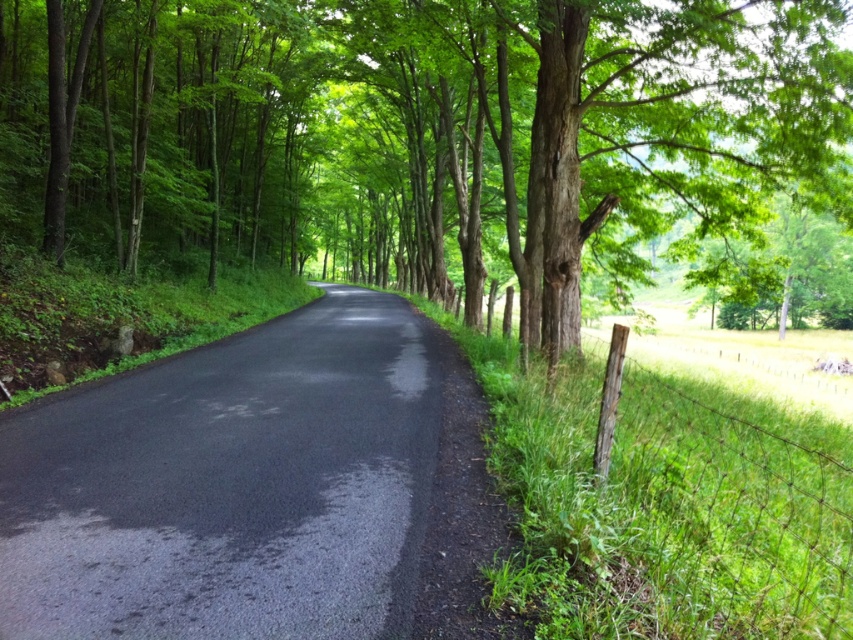
Question: Can you confirm if green leafy tree at center is positioned to the left of black asphalt road at center?

Choices:
 (A) yes
 (B) no

Answer: (B)

Question: Does green leafy tree at center have a larger size compared to black asphalt road at center?

Choices:
 (A) no
 (B) yes

Answer: (B)

Question: Which point is farther from the camera taking this photo?

Choices:
 (A) (387, 161)
 (B) (404, 336)

Answer: (A)

Question: Can you confirm if green leafy tree at center is thinner than black asphalt road at center?

Choices:
 (A) no
 (B) yes

Answer: (A)

Question: Which point is farther to the camera?

Choices:
 (A) click(250, 384)
 (B) click(376, 193)

Answer: (B)